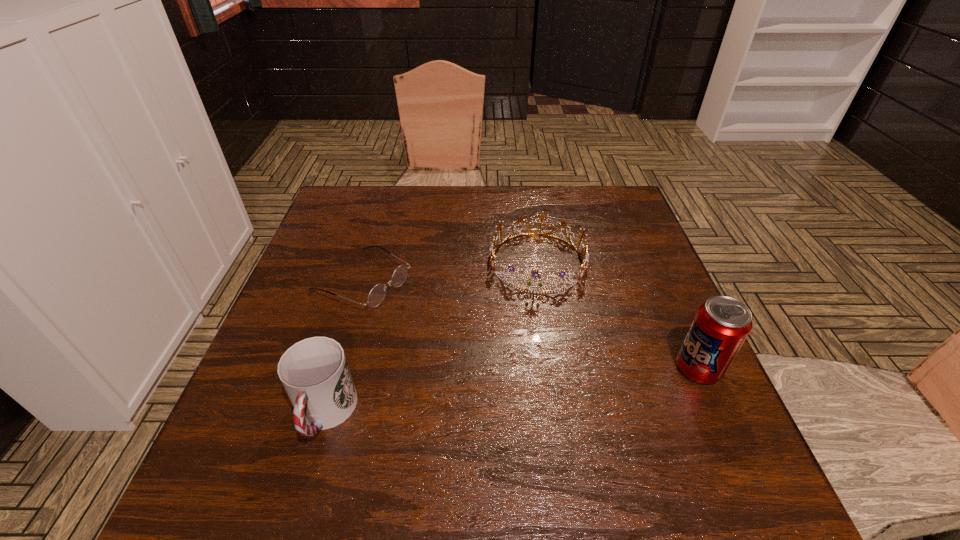
Find the location of a particular element. free spot on the desktop that is between the third shortest object and the tallest object and is positioned on the front-facing side of the tiara is located at coordinates (524, 390).

This screenshot has width=960, height=540. What are the coordinates of `free spot on the desktop that is between the cup and the rightmost object and is positioned through the lenses of the spectacles` in the screenshot? It's located at (571, 384).